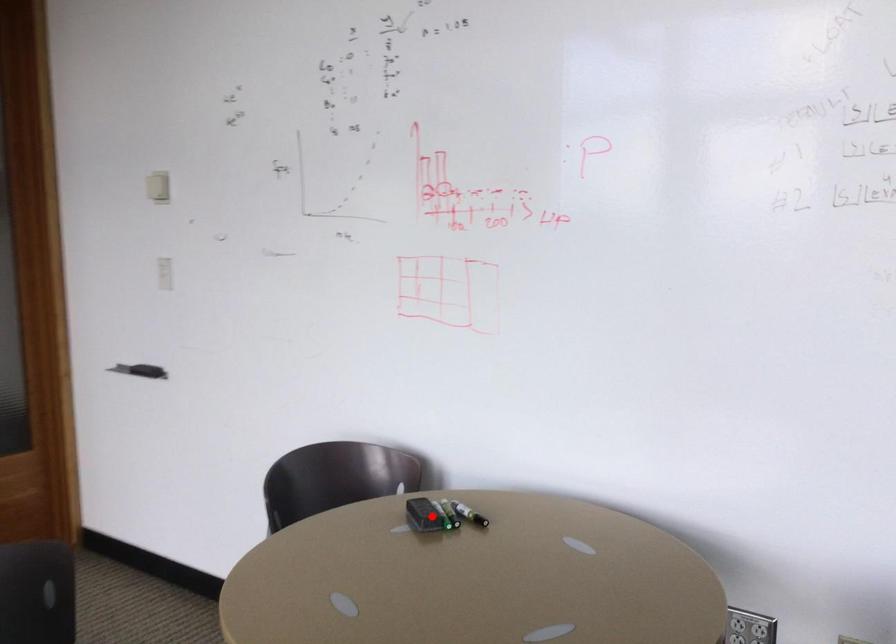
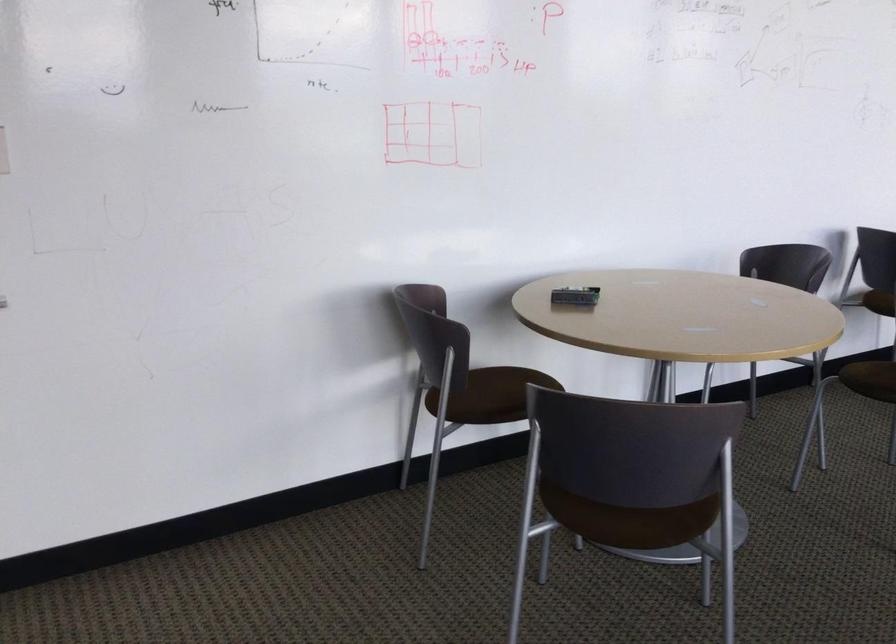
The point at the highlighted location is marked in the first image. Where is the corresponding point in the second image?

(575, 296)